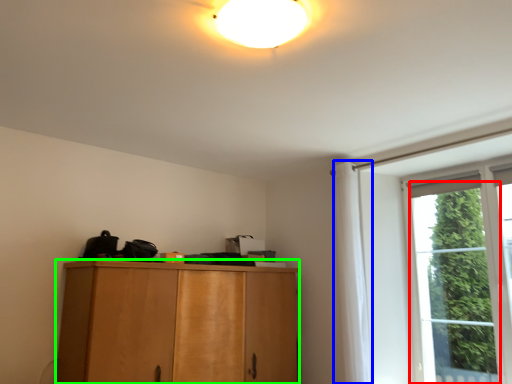
Question: Which object is positioned farthest from window (highlighted by a red box)? Select from curtain (highlighted by a blue box) and cabinetry (highlighted by a green box).

Choices:
 (A) curtain
 (B) cabinetry

Answer: (B)